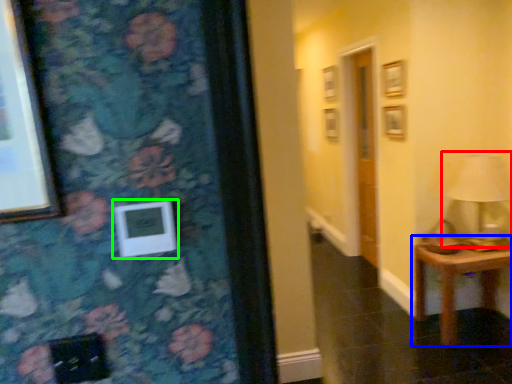
Question: Based on their relative distances, which object is nearer to table lamp (highlighted by a red box)? Choose from table (highlighted by a blue box) and picture frame (highlighted by a green box).

Choices:
 (A) table
 (B) picture frame

Answer: (A)